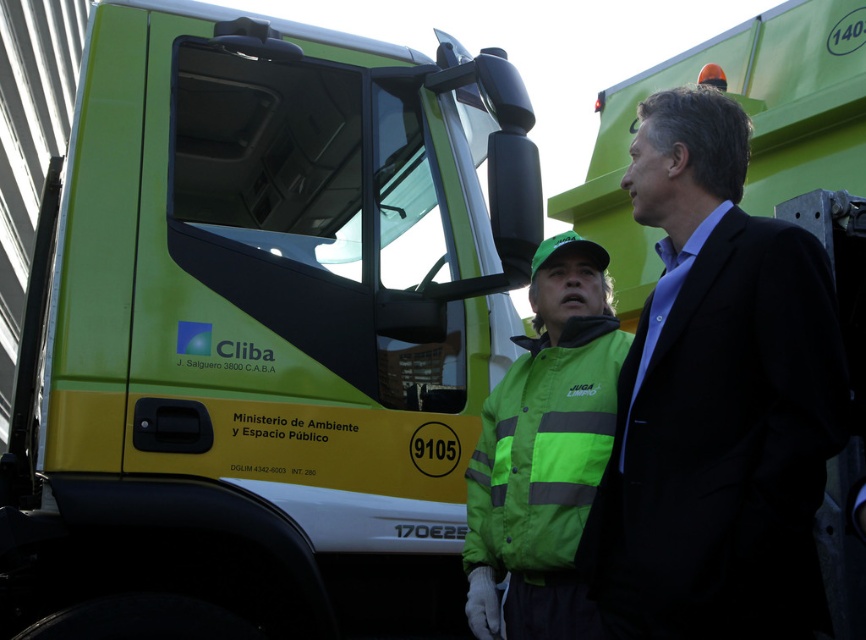
Where is the black matte suit at center located in the image?

The black matte suit at center is located at point coordinates of (716,401).

You are a pedestrian standing in front of the green matte truck at center and the black matte suit at center. Which object is closer to you?

The green matte truck at center is closer to you because the black matte suit at center is behind it.

You are a photographer trying to capture both the green matte truck at center and the black matte suit at center in a single frame. Given that the camera can only focus on objects within a certain height range, which object should you prioritize focusing on to ensure it appears clear in the photo?

The green matte truck at center is much taller than the black matte suit at center, so you should prioritize focusing on the green matte truck at center to ensure it appears clear in the photo.